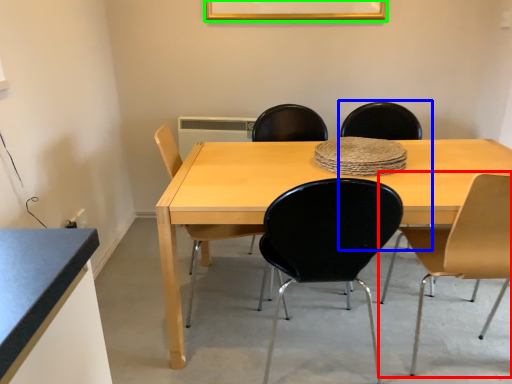
Question: Based on their relative distances, which object is farther from chair (highlighted by a red box)? Choose from chair (highlighted by a blue box) and picture frame (highlighted by a green box).

Choices:
 (A) chair
 (B) picture frame

Answer: (B)